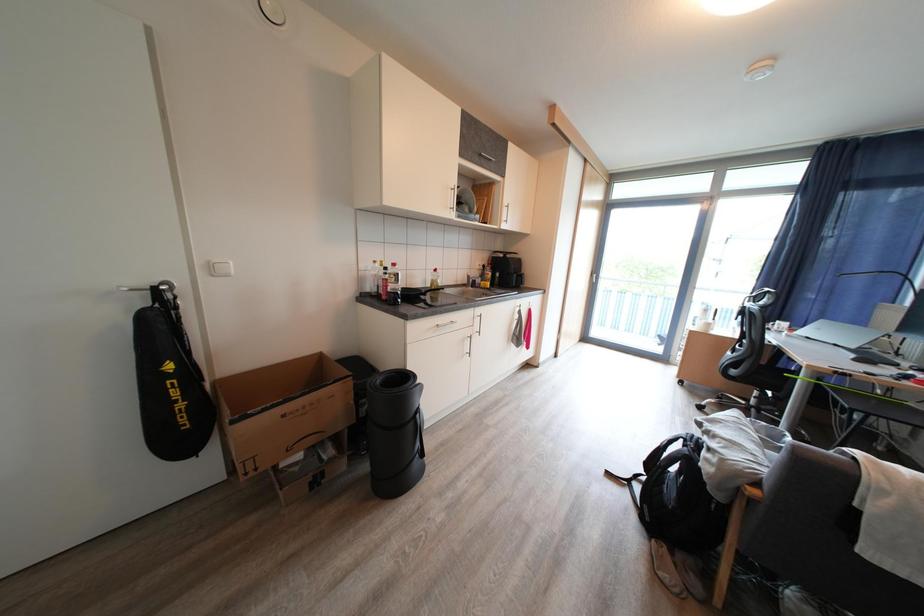
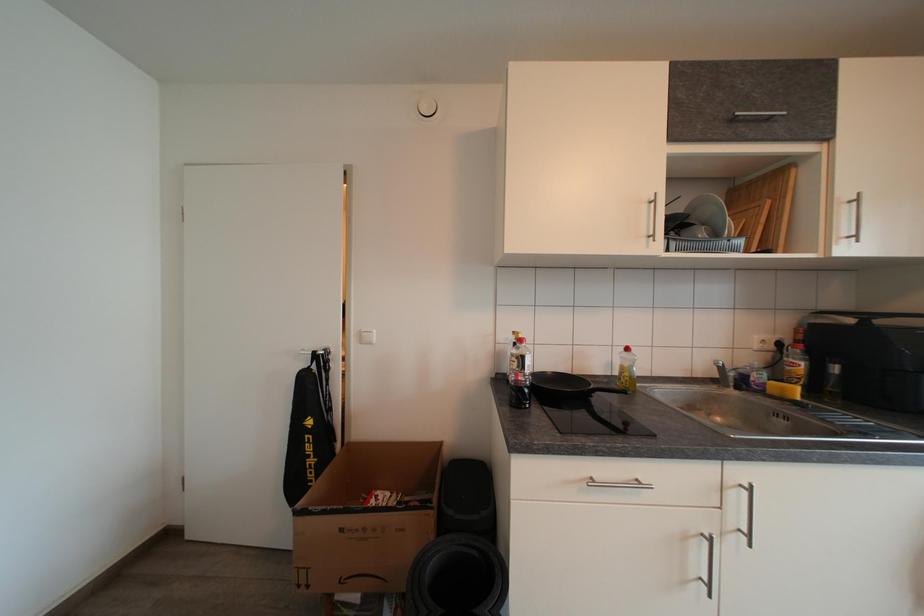
Question: Based on the continuous images, in which direction is the camera rotating? Reply with the corresponding letter.

Choices:
 (A) Left
 (B) Right
 (C) Up
 (D) Down

Answer: (A)